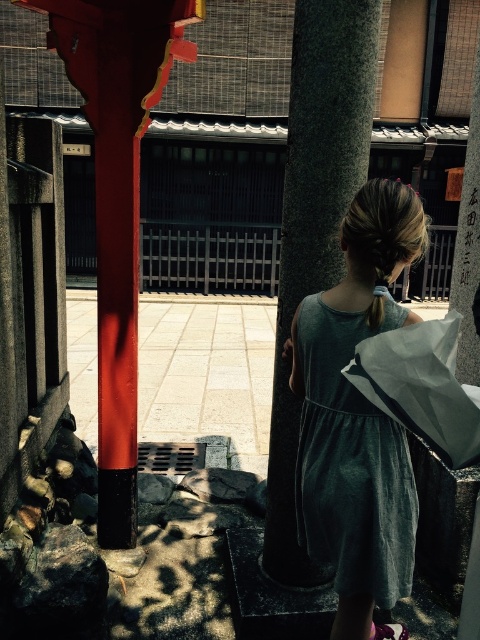
Question: Estimate the real-world distances between objects in this image. Which object is closer to the smooth red pole at left?

Choices:
 (A) smooth gray stone pillar at center
 (B) velvet teal dress at center

Answer: (A)

Question: Can you confirm if smooth red pole at left is smaller than white paper bag at center?

Choices:
 (A) yes
 (B) no

Answer: (B)

Question: Estimate the real-world distances between objects in this image. Which object is closer to the smooth red pole at left?

Choices:
 (A) smooth gray stone pillar at center
 (B) velvet teal dress at center

Answer: (A)

Question: Where is smooth red pole at left located in relation to white paper bag at center in the image?

Choices:
 (A) above
 (B) below

Answer: (A)

Question: Observing the image, what is the correct spatial positioning of smooth red pole at left in reference to white paper bag at center?

Choices:
 (A) left
 (B) right

Answer: (A)

Question: Which point is farther to the camera?

Choices:
 (A) smooth gray stone pillar at center
 (B) white paper bag at center
 (C) smooth red pole at left

Answer: (C)